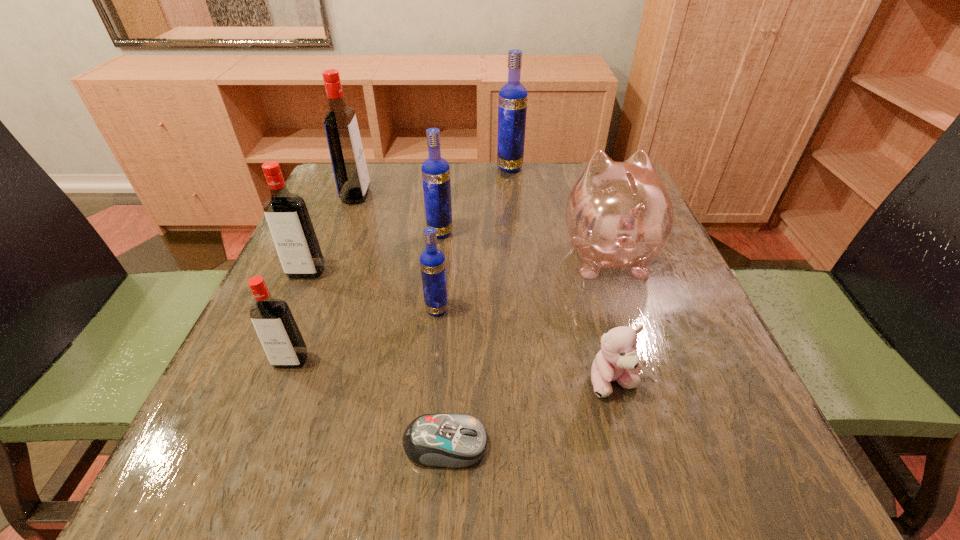
Locate an element on the screen. This screenshot has width=960, height=540. free point located 0.150m on the front and back of the second nearest red vodka is located at coordinates (276, 339).

Image resolution: width=960 pixels, height=540 pixels. Identify the location of free space located 0.150m on the front facing side of the piggy bank. (585, 188).

Find the location of a particular element. free space located on the front facing side of the piggy bank is located at coordinates (588, 199).

Locate an element on the screen. The height and width of the screenshot is (540, 960). vacant region located 0.170m on the front facing side of the piggy bank is located at coordinates (584, 184).

At what (x,y) coordinates should I click in order to perform the action: click on vacant space located on the front of the fourth nearest object. Please return your answer as a coordinate pair (x, y). This screenshot has width=960, height=540. Looking at the image, I should click on (418, 501).

In order to click on vacant space situated 0.050m on the front and back of the nearest vodka in this screenshot , I will do `click(276, 397)`.

Locate an element on the screen. The height and width of the screenshot is (540, 960). free spot located at the face of the pink teddy bear is located at coordinates pyautogui.click(x=634, y=460).

At what (x,y) coordinates should I click in order to perform the action: click on vacant space located 0.120m on the wheel side of the shortest object. Please return your answer as a coordinate pair (x, y). The height and width of the screenshot is (540, 960). Looking at the image, I should click on (572, 444).

Image resolution: width=960 pixels, height=540 pixels. In order to click on object at the near edge in this screenshot , I will do `click(450, 440)`.

Find the location of `piggy bank at the right edge`. piggy bank at the right edge is located at coordinates (619, 215).